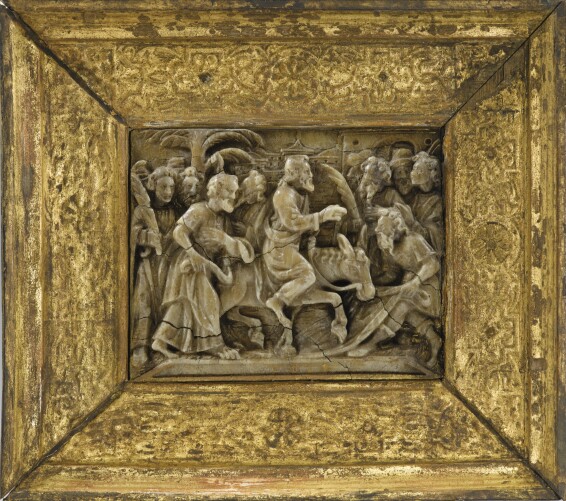
The width and height of the screenshot is (566, 501). I want to click on floor, so click(x=366, y=205), click(x=281, y=365).